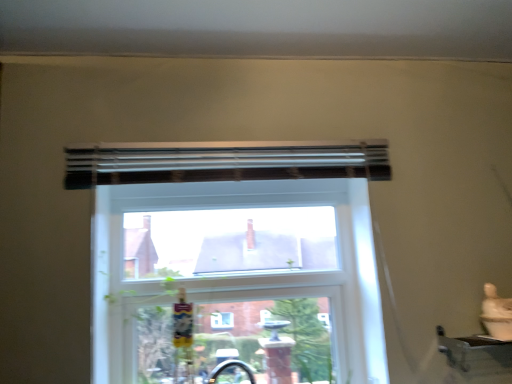
The height and width of the screenshot is (384, 512). What do you see at coordinates (231, 253) in the screenshot? I see `clear glass window at center` at bounding box center [231, 253].

I want to click on clear glass window at center, so click(231, 253).

Could you tell me if clear glass window at center is turned towards black matte curtain at upper center?

Yes, clear glass window at center faces towards black matte curtain at upper center.

Is clear glass window at center inside the boundaries of black matte curtain at upper center, or outside?

clear glass window at center is outside black matte curtain at upper center.

Who is smaller, clear glass window at center or black matte curtain at upper center?

Smaller between the two is black matte curtain at upper center.

Which of these two, clear glass window at center or black matte curtain at upper center, is thinner?

Thinner between the two is clear glass window at center.

Which is closer to the camera, [500,354] or [128,168]?

Positioned in front is point [128,168].

From a real-world perspective, between metallic silver window sill at lower right and clear glass window at center, who is vertically higher?

From a 3D spatial view, clear glass window at center is above.

Considering the relative sizes of metallic silver window sill at lower right and clear glass window at center in the image provided, is metallic silver window sill at lower right smaller than clear glass window at center?

Correct, metallic silver window sill at lower right occupies less space than clear glass window at center.

Is black matte curtain at upper center wider than clear glass window at center?

Correct, the width of black matte curtain at upper center exceeds that of clear glass window at center.

Can you see black matte curtain at upper center touching clear glass window at center?

No, black matte curtain at upper center is not next to clear glass window at center.

From the picture: Is black matte curtain at upper center inside the boundaries of clear glass window at center, or outside?

black matte curtain at upper center is spatially situated outside clear glass window at center.

Find the location of a particular element. window sill on the right of black matte curtain at upper center is located at coordinates (477, 357).

In the scene shown: Which object is thinner, black matte curtain at upper center or metallic silver window sill at lower right?

Thinner between the two is black matte curtain at upper center.

Is black matte curtain at upper center next to metallic silver window sill at lower right and touching it?

black matte curtain at upper center is not next to metallic silver window sill at lower right, and they're not touching.

From the image's perspective, between clear glass window at center and metallic silver window sill at lower right, which one is located above?

clear glass window at center appears higher in the image.

Is clear glass window at center not inside metallic silver window sill at lower right?

That's correct, clear glass window at center is outside of metallic silver window sill at lower right.

Does clear glass window at center turn towards metallic silver window sill at lower right?

No.

Between clear glass window at center and metallic silver window sill at lower right, which one has smaller width?

Thinner between the two is clear glass window at center.

Is the depth of metallic silver window sill at lower right greater than that of black matte curtain at upper center?

No, it is not.

Does metallic silver window sill at lower right touch black matte curtain at upper center?

No, metallic silver window sill at lower right is not with black matte curtain at upper center.

This screenshot has height=384, width=512. Find the location of `window sill lying below the black matte curtain at upper center (from the image's perspective)`. window sill lying below the black matte curtain at upper center (from the image's perspective) is located at coordinates tap(477, 357).

From a real-world perspective, who is located higher, metallic silver window sill at lower right or black matte curtain at upper center?

black matte curtain at upper center, from a real-world perspective.

Locate an element on the screen. The image size is (512, 384). window lying below the black matte curtain at upper center (from the image's perspective) is located at coordinates coord(231,253).

At what (x,y) coordinates should I click in order to perform the action: click on window behind the metallic silver window sill at lower right. Please return your answer as a coordinate pair (x, y). Image resolution: width=512 pixels, height=384 pixels. Looking at the image, I should click on (231, 253).

Based on their spatial positions, is clear glass window at center or metallic silver window sill at lower right further from black matte curtain at upper center?

metallic silver window sill at lower right.

Considering their positions, is black matte curtain at upper center positioned further to metallic silver window sill at lower right than clear glass window at center?

black matte curtain at upper center is positioned further to the anchor metallic silver window sill at lower right.

When comparing their distances from black matte curtain at upper center, does metallic silver window sill at lower right or clear glass window at center seem further?

metallic silver window sill at lower right is further to black matte curtain at upper center.

Estimate the real-world distances between objects in this image. Which object is closer to clear glass window at center, metallic silver window sill at lower right or black matte curtain at upper center?

black matte curtain at upper center.

When comparing their distances from clear glass window at center, does black matte curtain at upper center or metallic silver window sill at lower right seem closer?

black matte curtain at upper center is positioned closer to the anchor clear glass window at center.

Considering their positions, is clear glass window at center positioned further to metallic silver window sill at lower right than black matte curtain at upper center?

black matte curtain at upper center.

Find the location of `curtain located between clear glass window at center and metallic silver window sill at lower right in the left-right direction`. curtain located between clear glass window at center and metallic silver window sill at lower right in the left-right direction is located at coordinates (223, 162).